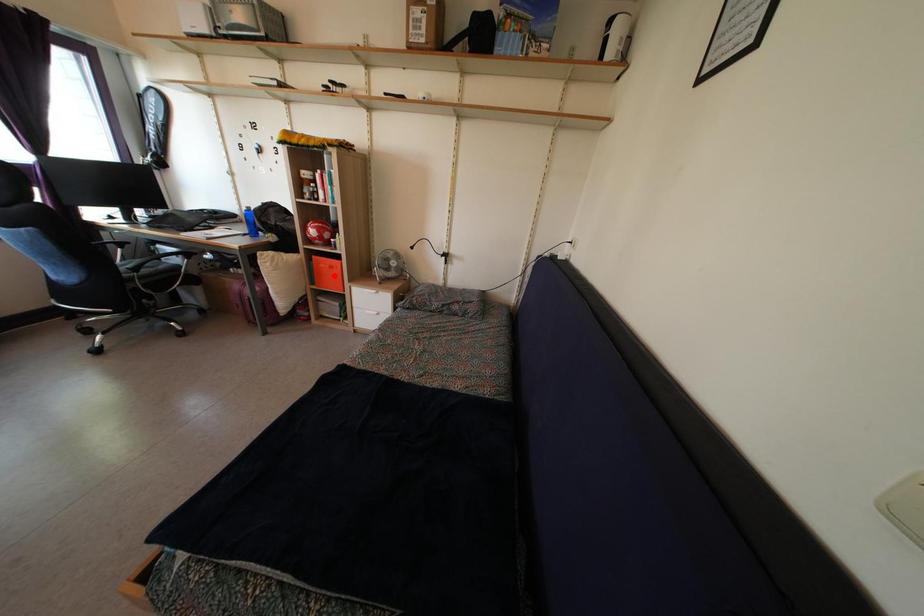
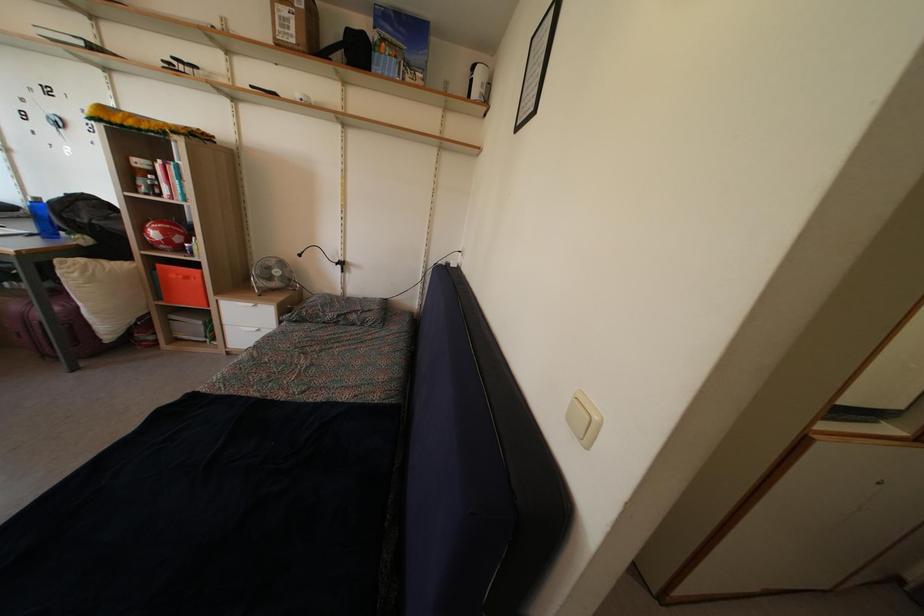
Question: I am providing you with two images of the same scene from different viewpoints. Image1 has a red point marked. In image2, the corresponding 3D location appears at what relative position? Reply with the corresponding letter.

Choices:
 (A) Closer
 (B) Farther

Answer: (B)